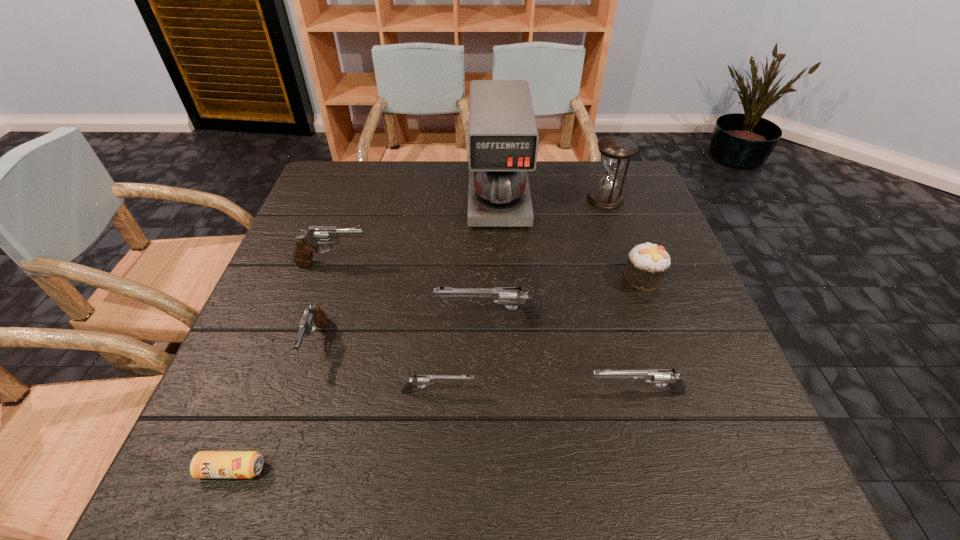
At what (x,y) coordinates should I click in order to perform the action: click on coffee maker. Please return your answer as a coordinate pair (x, y). This screenshot has height=540, width=960. Looking at the image, I should click on (503, 138).

The height and width of the screenshot is (540, 960). I want to click on the eighth shortest object, so click(616, 150).

Locate an element on the screen. the farthest pistol is located at coordinates (307, 244).

Where is `the seventh shortest object`? The image size is (960, 540). the seventh shortest object is located at coordinates (307, 244).

Find the location of `cupcake`. cupcake is located at coordinates (647, 263).

Where is `the farthest silver pistol`? the farthest silver pistol is located at coordinates (514, 295).

Where is `the nearer gray pistol`? The image size is (960, 540). the nearer gray pistol is located at coordinates coord(313,317).

You are a GUI agent. You are given a task and a screenshot of the screen. Output one action in this format:
    pyautogui.click(x=<x>, y=<y>)
    Task: Click on the second shortest pistol
    Image resolution: width=960 pixels, height=540 pixels.
    Given the screenshot: What is the action you would take?
    pyautogui.click(x=668, y=377)

In order to click on the second biggest silver pistol in this screenshot , I will do `click(668, 377)`.

This screenshot has width=960, height=540. What are the coordinates of `the eighth tallest object` in the screenshot? It's located at (424, 380).